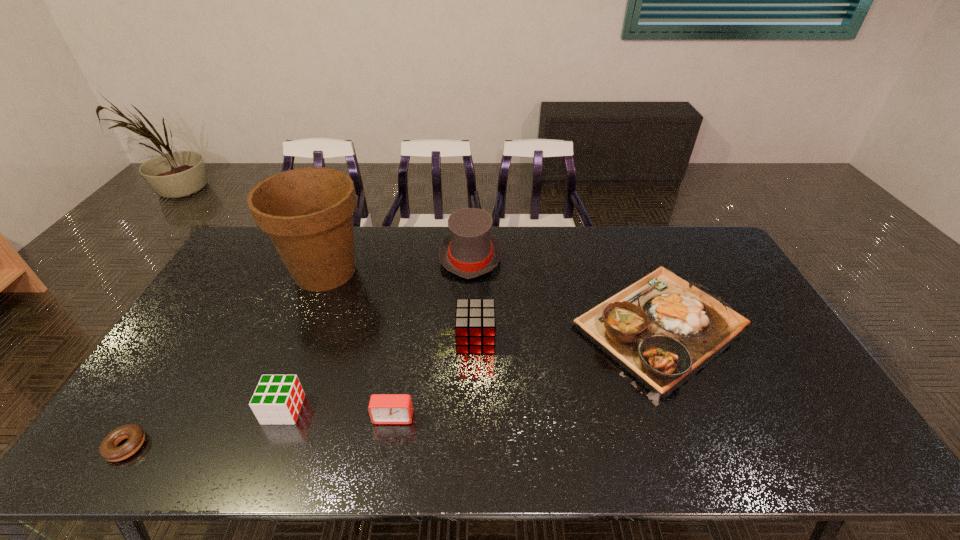
At what (x,y) coordinates should I click in order to perform the action: click on object located in the right edge section of the desktop. Please return your answer as a coordinate pair (x, y). The width and height of the screenshot is (960, 540). Looking at the image, I should click on (662, 329).

You are a GUI agent. You are given a task and a screenshot of the screen. Output one action in this format:
    pyautogui.click(x=<x>, y=<y>)
    Task: Click on the object located at the near left corner
    This screenshot has width=960, height=540.
    Given the screenshot: What is the action you would take?
    pyautogui.click(x=108, y=449)

In order to click on vacant space at the far edge of the desktop in this screenshot , I will do `click(501, 230)`.

The image size is (960, 540). In the image, there is a desktop. Identify the location of vacant area at the near edge. [x=690, y=431].

Image resolution: width=960 pixels, height=540 pixels. In order to click on vacant space at the left edge in this screenshot , I will do `click(242, 269)`.

I want to click on vacant space at the right edge, so click(x=800, y=424).

Where is `free space at the far right corner`? The height and width of the screenshot is (540, 960). free space at the far right corner is located at coordinates (671, 227).

Locate an element on the screen. free space at the near right corner is located at coordinates click(x=828, y=462).

The width and height of the screenshot is (960, 540). In order to click on free space between the alarm clock and the nearest object in this screenshot , I will do `click(260, 431)`.

This screenshot has height=540, width=960. What are the coordinates of `blank region between the rightmost object and the fourth object from left to right` in the screenshot? It's located at (526, 372).